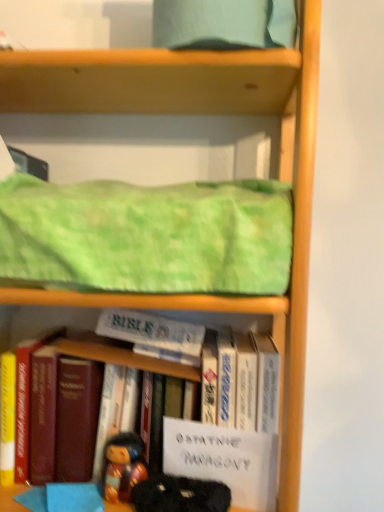
Question: From a real-world perspective, is green textured fabric at upper center above or below velvet-like black doll at lower center?

Choices:
 (A) below
 (B) above

Answer: (B)

Question: Looking at their shapes, would you say green textured fabric at upper center is wider or thinner than velvet-like black doll at lower center?

Choices:
 (A) wide
 (B) thin

Answer: (A)

Question: Which is farther from the velvet-like black doll at lower center?

Choices:
 (A) green textured fabric at upper center
 (B) hardcover book at center, the first book in the left-to-right sequence
 (C) white paper at center, which is counted as the 1th paperback book, starting from the bottom
 (D) hardcover book at center, which is counted as the 1th book, starting from the right
 (E) wooden figurine at lower center

Answer: (A)

Question: Based on their relative distances, which object is nearer to the white paper at center, the first paperback book in the front-to-back sequence?

Choices:
 (A) hardcover book at center, which ranks as the 2th book in right-to-left order
 (B) white paper at center, the second paperback book from the bottom
 (C) green textured fabric at upper center
 (D) hardcover book at center, marked as the second book in a left-to-right arrangement
 (E) wooden figurine at lower center

Answer: (D)